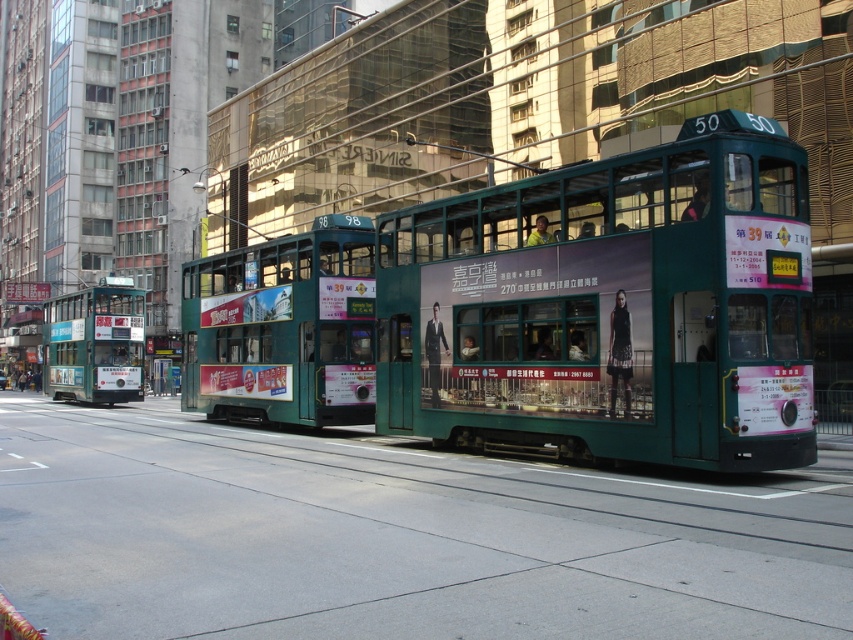
You are a photographer trying to capture both the green metallic tram at center and the green metallic tram at left in a single shot. Given their sizes in the frame, which tram should you focus on to ensure both are visible without cropping?

Since the green metallic tram at center occupies less space than the green metallic tram at left, you should focus on the larger green metallic tram at left to ensure both are visible in the frame without cropping.